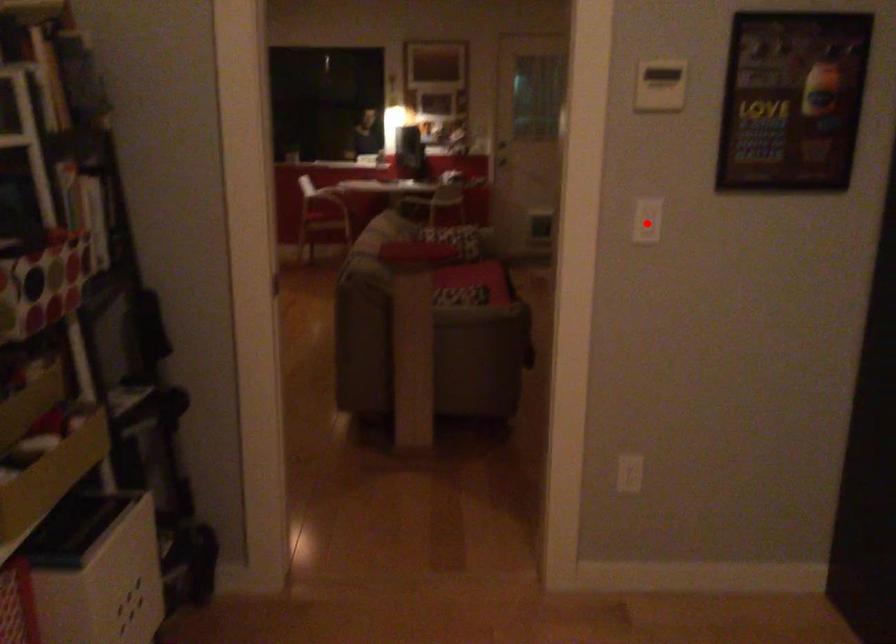
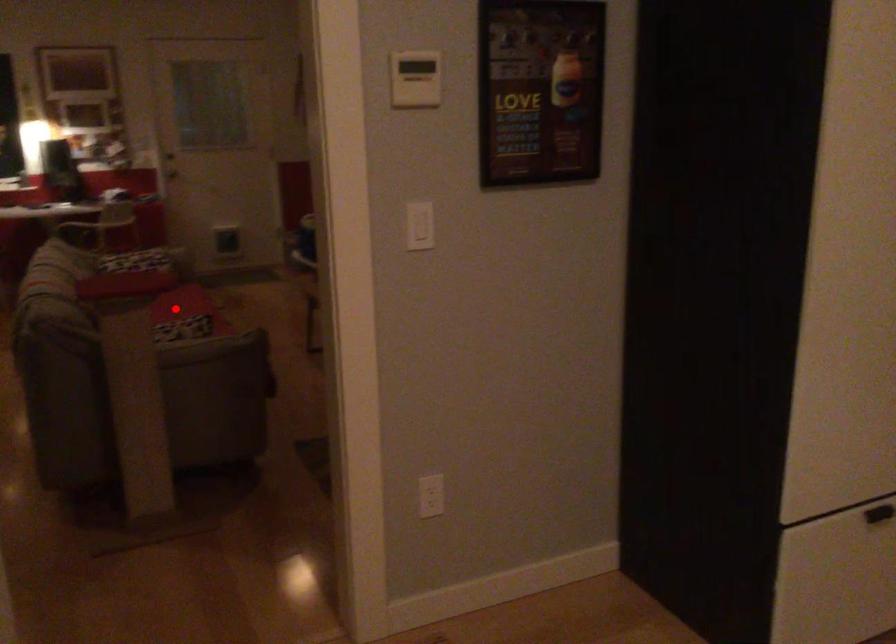
I am providing you with two images of the same scene from different viewpoints. A red point is marked on the first image and another point is marked on the second image. Do the highlighted points in image1 and image2 indicate the same real-world spot?

No